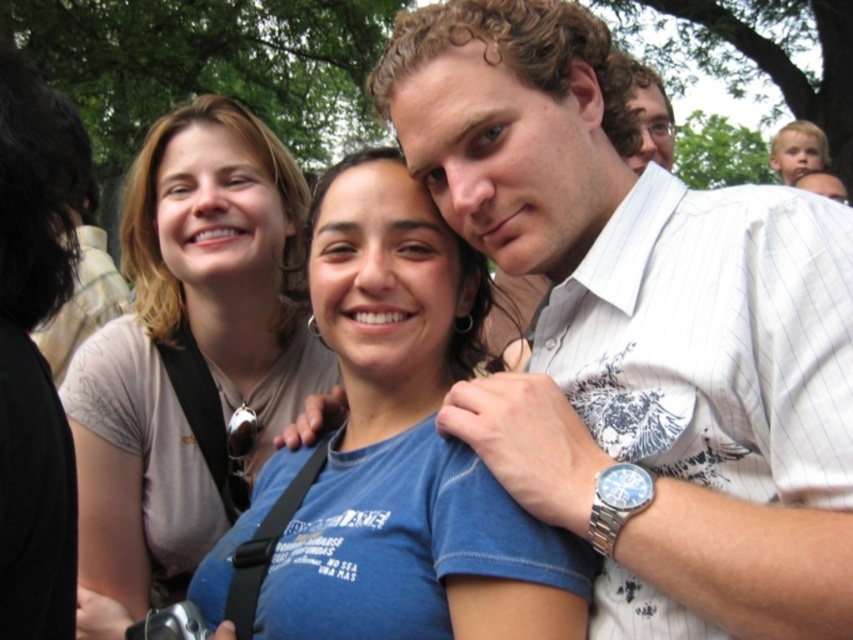
Question: Is matte beige shirt at upper left to the right of matte black glasses at upper center from the viewer's perspective?

Choices:
 (A) no
 (B) yes

Answer: (A)

Question: Which point is closer to the camera taking this photo?

Choices:
 (A) (669, 124)
 (B) (312, 564)

Answer: (B)

Question: Based on their relative distances, which object is nearer to the white pinstriped shirt at center?

Choices:
 (A) matte beige shirt at upper left
 (B) blue cotton shirt at center

Answer: (B)

Question: Which point is farther from the camera taking this photo?

Choices:
 (A) (169, 317)
 (B) (573, 278)
 (C) (653, 70)

Answer: (C)

Question: Can you confirm if white pinstriped shirt at center is positioned below matte black glasses at upper center?

Choices:
 (A) yes
 (B) no

Answer: (A)

Question: Is matte beige shirt at upper left positioned at the back of matte black glasses at upper center?

Choices:
 (A) no
 (B) yes

Answer: (B)